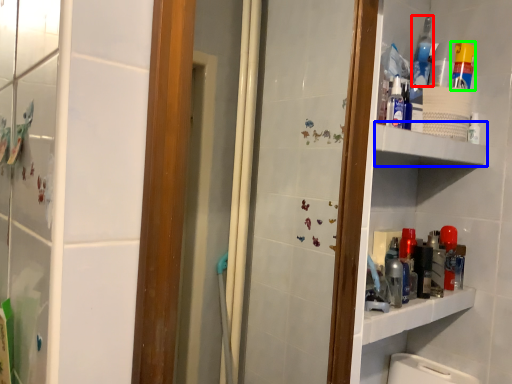
Question: Estimate the real-world distances between objects in this image. Which object is farther from mouthwash (highlighted by a red box), shelve (highlighted by a blue box) or cleaning product (highlighted by a green box)?

Choices:
 (A) shelve
 (B) cleaning product

Answer: (A)